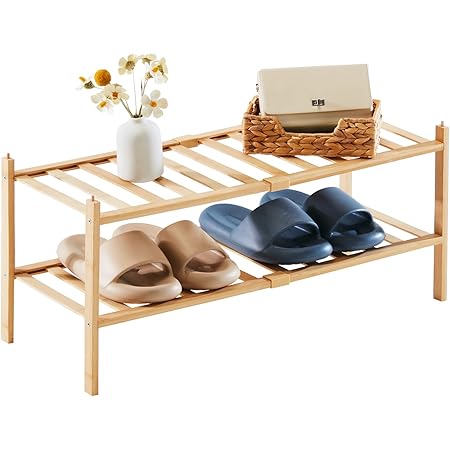
Identify the location of vase. (131, 138), (142, 154), (150, 137), (149, 170).